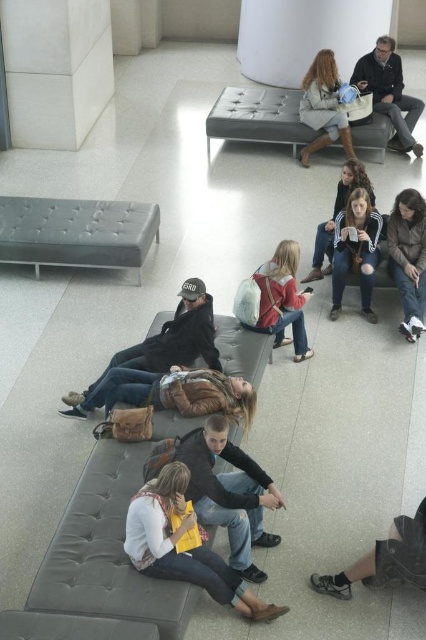
Question: Does tufted leather bench at upper center have a smaller size compared to matte black jacket at upper right?

Choices:
 (A) no
 (B) yes

Answer: (A)

Question: Can you confirm if white cotton shirt at center is positioned above tufted leather bench at upper center?

Choices:
 (A) no
 (B) yes

Answer: (A)

Question: Can you confirm if white cotton shirt at center is positioned above tufted leather bench at upper center?

Choices:
 (A) yes
 (B) no

Answer: (B)

Question: Among these objects, which one is nearest to the camera?

Choices:
 (A) white cotton shirt at center
 (B) tufted leather bench at upper center

Answer: (A)

Question: Which object appears farthest from the camera in this image?

Choices:
 (A) matte gray bench at lower left
 (B) tufted leather bench at upper center
 (C) white textured backpack at center

Answer: (B)

Question: Which of the following is the closest to the observer?

Choices:
 (A) matte beige coat at center
 (B) tufted leather bench at upper center
 (C) matte black jacket at upper right

Answer: (C)